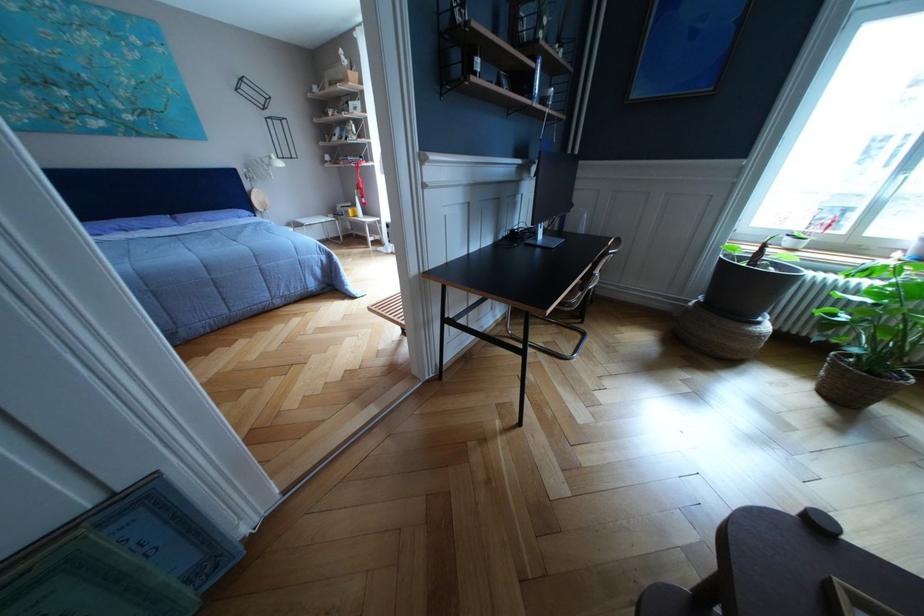
Which object does [748,286] point to?

It corresponds to the large grey pot in the image.